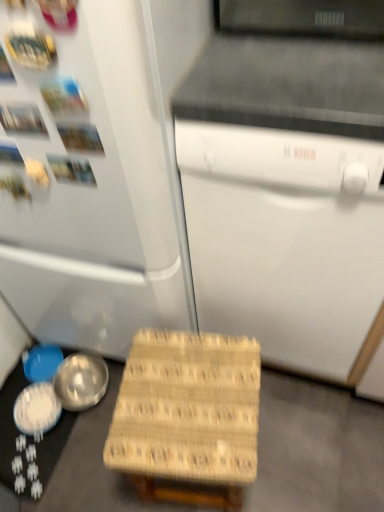
This screenshot has height=512, width=384. Identify the location of vacant area located to the right-hand side of woven wood step stool at lower center. (296, 445).